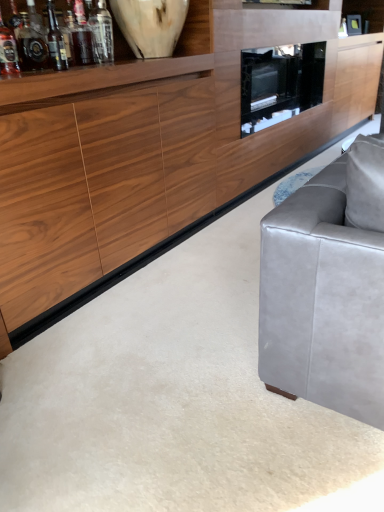
In order to click on white marble vase at upper left in this screenshot , I will do `click(150, 25)`.

The width and height of the screenshot is (384, 512). What do you see at coordinates (151, 151) in the screenshot?
I see `wooden cabinet at center` at bounding box center [151, 151].

From the picture: Measure the distance between point (314, 30) and camera.

3.29 meters.

Describe the element at coordinates (56, 41) in the screenshot. This screenshot has width=384, height=512. I see `translucent glass wine bottle at upper left` at that location.

Where is `clear glass bottle at upper left, the first bottle positioned from the right`? clear glass bottle at upper left, the first bottle positioned from the right is located at coordinates (101, 32).

What do you see at coordinates (280, 83) in the screenshot? The height and width of the screenshot is (512, 384). I see `black glass tv cabinet at center` at bounding box center [280, 83].

Identify the location of matte glass bottle at left, positioned as the 2th bottle in left-to-right order. (32, 42).

From a real-world perspective, is translucent glass wine bottle at upper left under wooden cabinet at center?

No, from a real-world perspective, translucent glass wine bottle at upper left is not under wooden cabinet at center.

Does translucent glass wine bottle at upper left come behind wooden cabinet at center?

Yes, it is.

Is translucent glass wine bottle at upper left aimed at wooden cabinet at center?

Yes, translucent glass wine bottle at upper left is facing wooden cabinet at center.

Is there a large distance between translucent glass wine bottle at upper left and wooden cabinet at center?

No, translucent glass wine bottle at upper left is not far from wooden cabinet at center.

Between matte glass bottle at left, which is counted as the 3th bottle, starting from the right, and translucent glass bottle at upper left, placed as the 1th bottle when sorted from left to right, which one is positioned in front?

Positioned in front is translucent glass bottle at upper left, placed as the 1th bottle when sorted from left to right.

Considering the positions of point (45, 42) and point (12, 34), is point (45, 42) closer or farther from the camera than point (12, 34)?

Point (45, 42) is positioned farther from the camera compared to point (12, 34).

Can you confirm if matte glass bottle at left, which is counted as the 3th bottle, starting from the right, is wider than translucent glass bottle at upper left, which is counted as the fourth bottle, starting from the right?

Correct, the width of matte glass bottle at left, which is counted as the 3th bottle, starting from the right, exceeds that of translucent glass bottle at upper left, which is counted as the fourth bottle, starting from the right.

From the image's perspective, which object appears higher, matte glass bottle at left, positioned as the 2th bottle in left-to-right order, or translucent glass bottle at upper left, which is counted as the fourth bottle, starting from the right?

matte glass bottle at left, positioned as the 2th bottle in left-to-right order, from the image's perspective.

Considering the positions of points (81, 31) and (295, 88), is point (81, 31) farther from camera compared to point (295, 88)?

No, it is in front of (295, 88).

Who is more distant, translucent glass bottle at upper left, the third bottle from the left, or black glass tv cabinet at center?

black glass tv cabinet at center is further away from the camera.

Is translucent glass bottle at upper left, the third bottle from the left, aimed at black glass tv cabinet at center?

No, translucent glass bottle at upper left, the third bottle from the left, does not turn towards black glass tv cabinet at center.

Considering the sizes of objects translucent glass bottle at upper left, acting as the 2th bottle starting from the right, and black glass tv cabinet at center in the image provided, who is wider, translucent glass bottle at upper left, acting as the 2th bottle starting from the right, or black glass tv cabinet at center?

Wider between the two is black glass tv cabinet at center.

How many degrees apart are the facing directions of translucent glass bottle at upper left, which is counted as the fourth bottle, starting from the right, and wooden cabinet at center?

The facing directions of translucent glass bottle at upper left, which is counted as the fourth bottle, starting from the right, and wooden cabinet at center are 1.34 degrees apart.

Is translucent glass bottle at upper left, placed as the 1th bottle when sorted from left to right, next to wooden cabinet at center and touching it?

translucent glass bottle at upper left, placed as the 1th bottle when sorted from left to right, and wooden cabinet at center are not in contact.

Which is more to the right, translucent glass bottle at upper left, placed as the 1th bottle when sorted from left to right, or wooden cabinet at center?

From the viewer's perspective, wooden cabinet at center appears more on the right side.

Is wooden cabinet at center located within translucent glass bottle at upper left, placed as the 1th bottle when sorted from left to right?

No, wooden cabinet at center is not a part of translucent glass bottle at upper left, placed as the 1th bottle when sorted from left to right.

Are black glass tv cabinet at center and matte glass bottle at left, positioned as the 2th bottle in left-to-right order, far apart?

Indeed, black glass tv cabinet at center is not near matte glass bottle at left, positioned as the 2th bottle in left-to-right order.

Is black glass tv cabinet at center positioned with its back to matte glass bottle at left, positioned as the 2th bottle in left-to-right order?

No, black glass tv cabinet at center is not facing the opposite direction of matte glass bottle at left, positioned as the 2th bottle in left-to-right order.

From the black glass tv cabinet at center, count 3rd bottles forward and point to it. Please provide its 2D coordinates.

[(32, 42)]

Which object is closer to the camera, black glass tv cabinet at center or clear glass bottle at upper left, the 4th bottle when ordered from left to right?

clear glass bottle at upper left, the 4th bottle when ordered from left to right.

Between black glass tv cabinet at center and clear glass bottle at upper left, the 4th bottle when ordered from left to right, which one appears on the right side from the viewer's perspective?

black glass tv cabinet at center.

What's the angular difference between black glass tv cabinet at center and clear glass bottle at upper left, the 4th bottle when ordered from left to right,'s facing directions?

black glass tv cabinet at center and clear glass bottle at upper left, the 4th bottle when ordered from left to right, are facing 1.8 degrees away from each other.

Which point is more distant from viewer, (250, 64) or (108, 12)?

Positioned behind is point (250, 64).

From the image's perspective, does translucent glass wine bottle at upper left appear lower than black glass tv cabinet at center?

Yes, from the image's perspective, translucent glass wine bottle at upper left is beneath black glass tv cabinet at center.

Are translucent glass wine bottle at upper left and black glass tv cabinet at center far apart?

Yes, translucent glass wine bottle at upper left and black glass tv cabinet at center are located far from each other.

In order to click on tv cabinet that is on the right side of translucent glass wine bottle at upper left in this screenshot , I will do click(x=280, y=83).

Locate an element on the screen. wine bottle on the left of wooden cabinet at center is located at coordinates (56, 41).

Where is `bottle located underneath the translucent glass bottle at upper left, which is counted as the fourth bottle, starting from the right (from a real-world perspective)`? bottle located underneath the translucent glass bottle at upper left, which is counted as the fourth bottle, starting from the right (from a real-world perspective) is located at coordinates click(x=32, y=42).

Looking at the image, which one is located closer to matte glass bottle at left, which is counted as the 3th bottle, starting from the right, translucent glass wine bottle at upper left or clear glass bottle at upper left, the first bottle positioned from the right?

translucent glass wine bottle at upper left is closer to matte glass bottle at left, which is counted as the 3th bottle, starting from the right.

When comparing their distances from matte glass bottle at left, positioned as the 2th bottle in left-to-right order, does translucent glass bottle at upper left, acting as the 2th bottle starting from the right, or clear glass bottle at upper left, the 4th bottle when ordered from left to right, seem further?

The object further to matte glass bottle at left, positioned as the 2th bottle in left-to-right order, is clear glass bottle at upper left, the 4th bottle when ordered from left to right.

Based on the photo, which object lies further to the anchor point clear glass bottle at upper left, the 4th bottle when ordered from left to right, wooden cabinet at center or translucent glass wine bottle at upper left?

Among the two, wooden cabinet at center is located further to clear glass bottle at upper left, the 4th bottle when ordered from left to right.

When comparing their distances from wooden cabinet at center, does translucent glass bottle at upper left, acting as the 2th bottle starting from the right, or black glass tv cabinet at center seem closer?

black glass tv cabinet at center is positioned closer to the anchor wooden cabinet at center.

Estimate the real-world distances between objects in this image. Which object is further from white marble vase at upper left, black glass tv cabinet at center or matte glass bottle at left, positioned as the 2th bottle in left-to-right order?

The object further to white marble vase at upper left is black glass tv cabinet at center.

Based on their spatial positions, is wooden cabinet at center or white marble vase at upper left closer to translucent glass bottle at upper left, acting as the 2th bottle starting from the right?

white marble vase at upper left is closer to translucent glass bottle at upper left, acting as the 2th bottle starting from the right.

Looking at this image, based on their spatial positions, is clear glass bottle at upper left, the 4th bottle when ordered from left to right, or black glass tv cabinet at center further from translucent glass wine bottle at upper left?

black glass tv cabinet at center is further to translucent glass wine bottle at upper left.

Based on the photo, based on their spatial positions, is translucent glass bottle at upper left, placed as the 1th bottle when sorted from left to right, or clear glass bottle at upper left, the 4th bottle when ordered from left to right, closer to black glass tv cabinet at center?

clear glass bottle at upper left, the 4th bottle when ordered from left to right.

Find the location of a particular element. The width and height of the screenshot is (384, 512). wine bottle located between translucent glass bottle at upper left, which is counted as the fourth bottle, starting from the right, and black glass tv cabinet at center in the left-right direction is located at coordinates (56, 41).

Find the location of a particular element. This screenshot has width=384, height=512. vase between clear glass bottle at upper left, the first bottle positioned from the right, and wooden cabinet at center is located at coordinates (150, 25).

Locate an element on the screen. The image size is (384, 512). vase situated between matte glass bottle at left, positioned as the 2th bottle in left-to-right order, and black glass tv cabinet at center from left to right is located at coordinates (150, 25).

In order to click on vase between translucent glass bottle at upper left, placed as the 1th bottle when sorted from left to right, and wooden cabinet at center in this screenshot , I will do `click(150, 25)`.